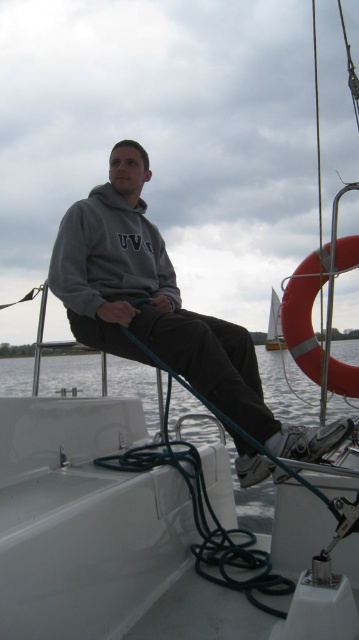
From the picture: You are a photographer trying to capture a photo of the gray fleece sweatshirt at center and the white fabric sail at center. Since you want both objects in the frame, which object should you position closer to the camera to ensure both are visible?

The gray fleece sweatshirt at center is to the left of the white fabric sail at center. To ensure both are visible in the frame, position the camera so that both objects are within the shot. Since their positions are side by side, adjusting the camera angle to include both their left and right sides would work best.

You are a sailor who wants to know if the white glossy water at lower center is higher than the white fabric sail at center. Based on the scene, can you confirm this?

The white glossy water at lower center is much taller than the white fabric sail at center, so yes, the white glossy water at lower center is higher than the white fabric sail at center.

You are a photographer trying to capture the scene of the person in the gray fleece hoodie at center and the white glossy water at lower center. Which object is shorter in height?

The gray fleece hoodie at center is not as tall as the white glossy water at lower center, so the gray fleece hoodie at center is shorter in height.